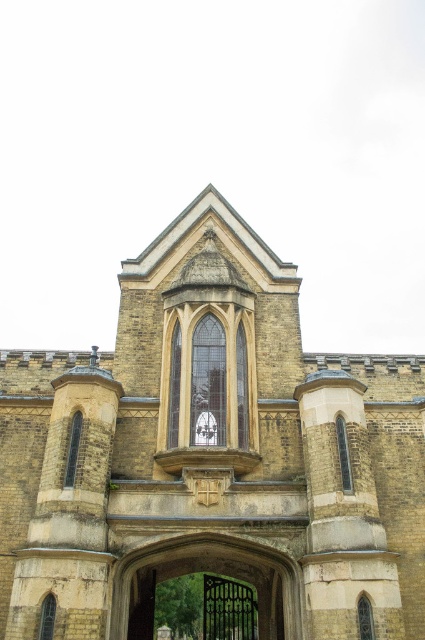
Can you confirm if yellow stone church at center is shorter than black wrought iron gate at center?

Incorrect, yellow stone church at center's height does not fall short of black wrought iron gate at center's.

I want to click on yellow stone church at center, so (x=210, y=456).

This screenshot has width=425, height=640. What do you see at coordinates (210, 456) in the screenshot? I see `yellow stone church at center` at bounding box center [210, 456].

This screenshot has width=425, height=640. Identify the location of yellow stone church at center. (210, 456).